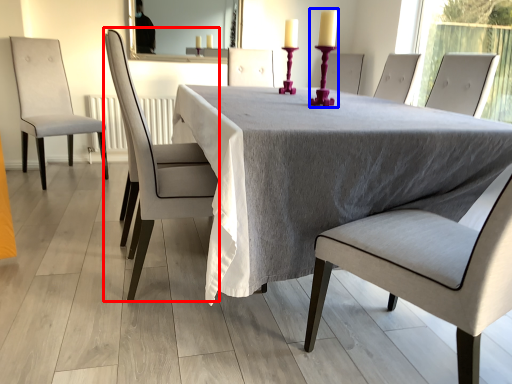
Question: Which of the following is the farthest to the observer, chair (highlighted by a red box) or candle holder (highlighted by a blue box)?

Choices:
 (A) chair
 (B) candle holder

Answer: (A)